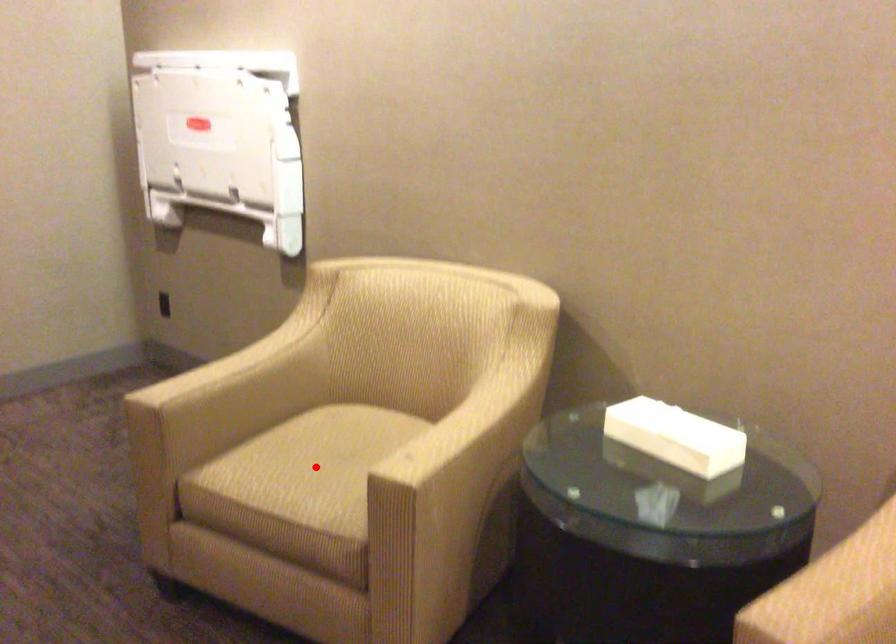
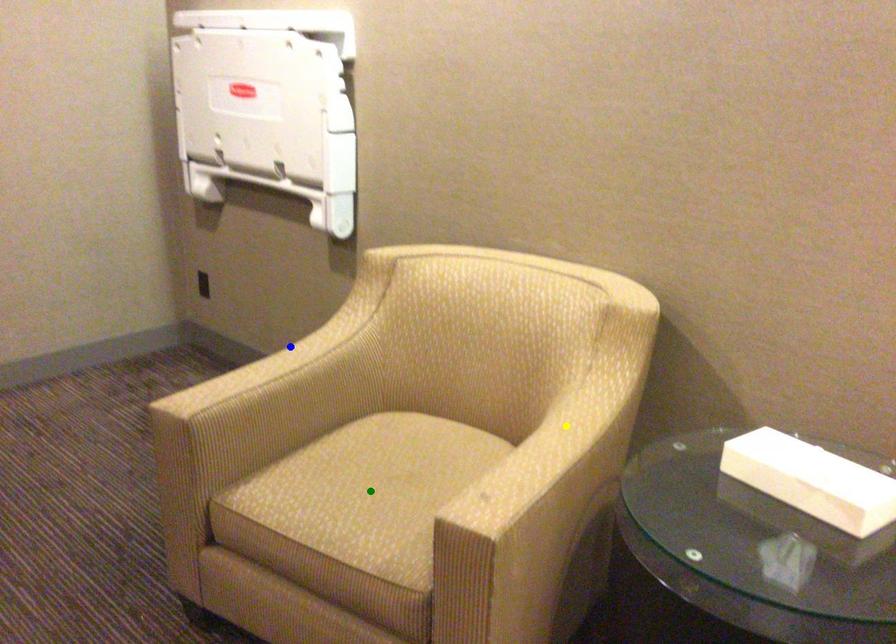
Question: I am providing you with two images of the same scene from different viewpoints. A red point is marked on the first image. You are given multiple points on the second image. Which point in image 2 represents the same 3d spot as the red point in image 1?

Choices:
 (A) yellow point
 (B) green point
 (C) blue point

Answer: (B)